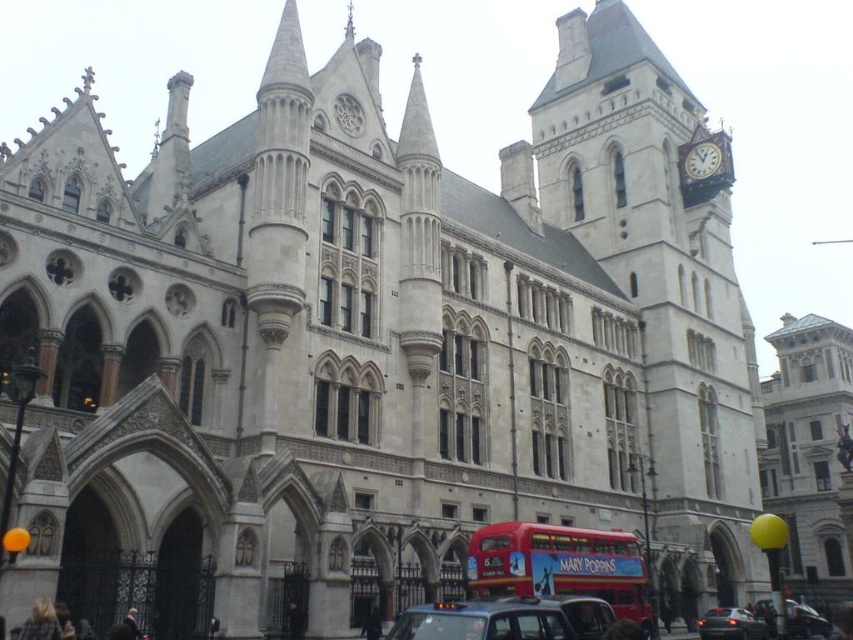
You are a pedestrian standing in front of the historic building and want to cross the street. There are two vehicles nearby. The black rubber taxi at center and the metallic silver car at lower right. Which vehicle is closer to the building?

The black rubber taxi at center is closer to the building because it is positioned to the left of the metallic silver car at lower right, which is further away from the building.

You are a pedestrian standing at the entrance of the historic building. You want to cross the street to reach the park on the other side. There are two vehicles nearby. The black rubber taxi at center and the metallic silver car at lower right. Which vehicle is closer to you?

The black rubber taxi at center is closer to you since it is only 32.83 meters away from the metallic silver car at lower right, but without knowing your exact position, it is hard to determine the closest one. However, based on the given distance between them, if you are near the building entrance, the black rubber taxi at center might be closer.